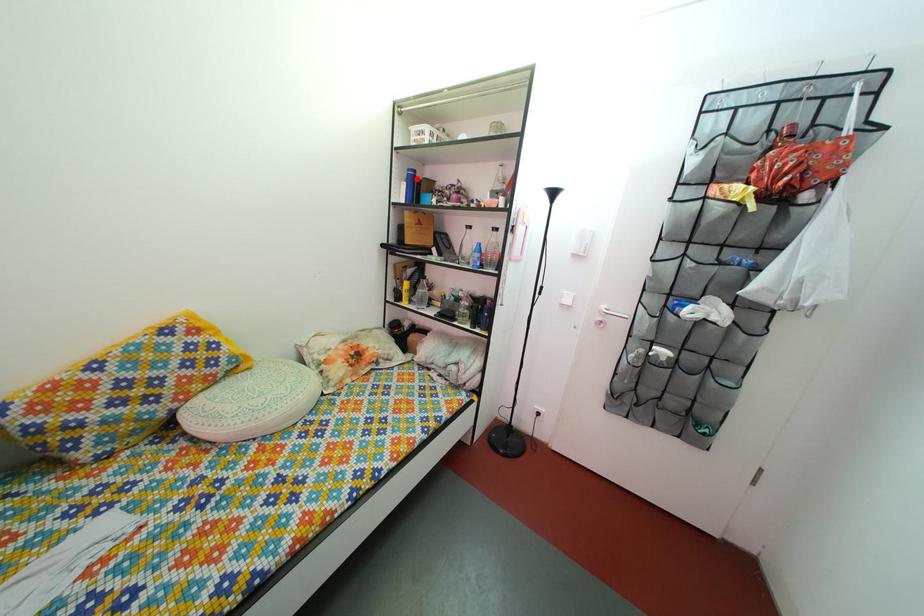
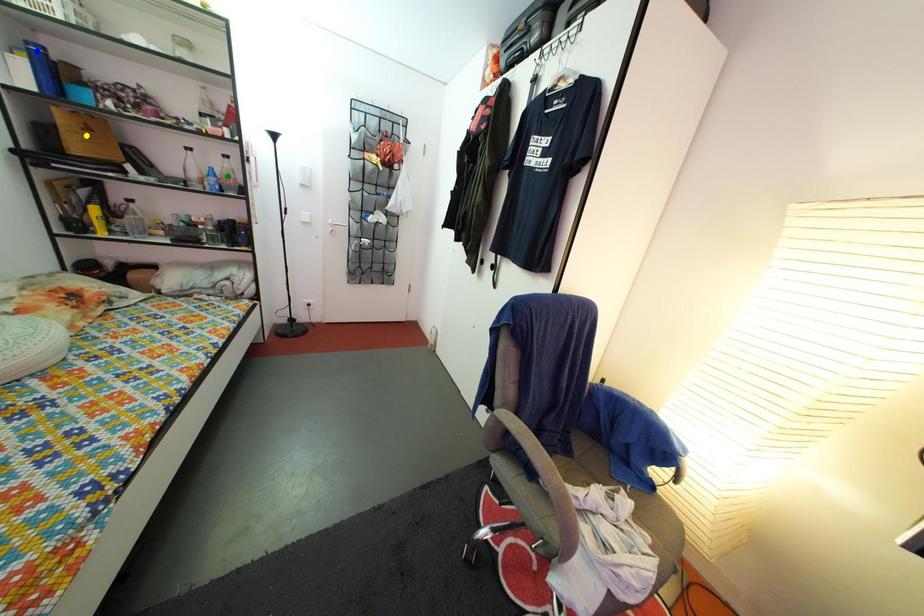
Question: I am providing you with two images of the same scene from different viewpoints. A red point is marked on the first image. You are given multiple points on the second image. Which point in image 2 represents the same 3d spot as the red point in image 1?

Choices:
 (A) yellow point
 (B) green point
 (C) blue point

Answer: (C)